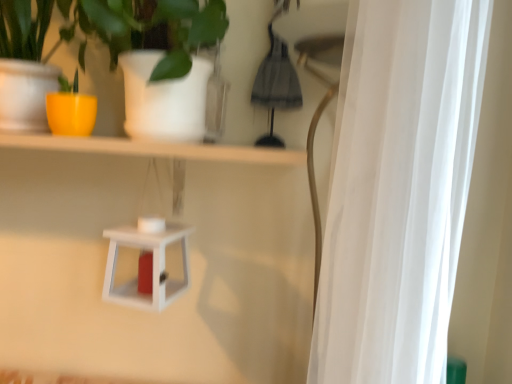
Question: From a real-world perspective, is yellow matte pot at left under white matte lantern at center?

Choices:
 (A) yes
 (B) no

Answer: (B)

Question: Can you confirm if yellow matte pot at left is positioned to the left of white matte lantern at center?

Choices:
 (A) yes
 (B) no

Answer: (B)

Question: From a real-world perspective, does yellow matte pot at left stand above white matte lantern at center?

Choices:
 (A) no
 (B) yes

Answer: (B)

Question: Is yellow matte pot at left positioned with its back to white matte lantern at center?

Choices:
 (A) no
 (B) yes

Answer: (A)

Question: Can you confirm if yellow matte pot at left is thinner than white matte lantern at center?

Choices:
 (A) no
 (B) yes

Answer: (A)

Question: Is the depth of yellow matte pot at left less than that of white matte lantern at center?

Choices:
 (A) yes
 (B) no

Answer: (A)

Question: From a real-world perspective, is white sheer curtain at right below white matte lantern at center?

Choices:
 (A) no
 (B) yes

Answer: (A)

Question: Considering the relative positions of white sheer curtain at right and white matte lantern at center in the image provided, is white sheer curtain at right in front of white matte lantern at center?

Choices:
 (A) no
 (B) yes

Answer: (B)

Question: Considering the relative positions of white sheer curtain at right and white matte lantern at center in the image provided, is white sheer curtain at right to the left of white matte lantern at center from the viewer's perspective?

Choices:
 (A) no
 (B) yes

Answer: (A)

Question: Is white sheer curtain at right not close to white matte lantern at center?

Choices:
 (A) yes
 (B) no

Answer: (B)

Question: Is white sheer curtain at right oriented away from white matte lantern at center?

Choices:
 (A) no
 (B) yes

Answer: (A)

Question: Does white sheer curtain at right have a larger size compared to white matte lantern at center?

Choices:
 (A) no
 (B) yes

Answer: (B)

Question: Is yellow matte pot at left looking in the opposite direction of white sheer curtain at right?

Choices:
 (A) yes
 (B) no

Answer: (B)